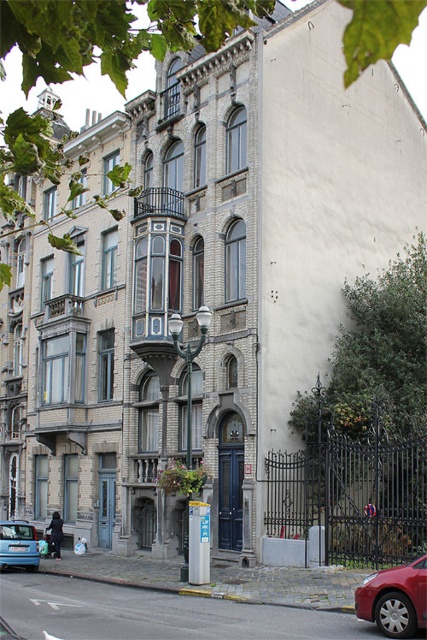
Between shiny red car at lower right and blue matte hatchback at lower left, which one has less height?

shiny red car at lower right is shorter.

Does shiny red car at lower right lie behind blue matte hatchback at lower left?

No, shiny red car at lower right is closer to the viewer.

Who is more forward, [386,598] or [29,532]?

Positioned in front is point [386,598].

I want to click on shiny red car at lower right, so click(x=394, y=598).